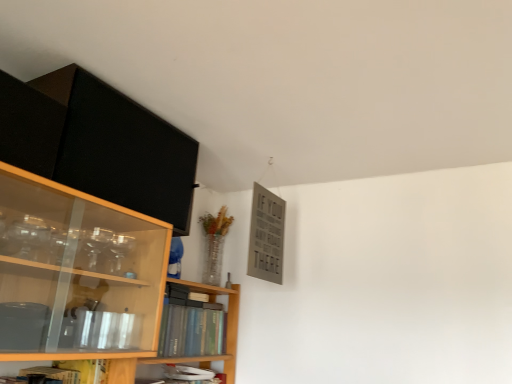
Question: Is hardcover book at center, which is the second book from bottom to top, next to matte black cabinet at upper left?

Choices:
 (A) no
 (B) yes

Answer: (A)

Question: Is hardcover book at center, the first book when ordered from top to bottom, positioned behind matte black cabinet at upper left?

Choices:
 (A) yes
 (B) no

Answer: (A)

Question: Does hardcover book at center, the first book when ordered from top to bottom, have a greater width compared to matte black cabinet at upper left?

Choices:
 (A) yes
 (B) no

Answer: (B)

Question: Can we say hardcover book at center, the first book when ordered from top to bottom, lies outside matte black cabinet at upper left?

Choices:
 (A) yes
 (B) no

Answer: (A)

Question: From the image's perspective, is hardcover book at center, the first book when ordered from top to bottom, above matte black cabinet at upper left?

Choices:
 (A) yes
 (B) no

Answer: (B)

Question: Is point (176, 375) positioned closer to the camera than point (218, 336)?

Choices:
 (A) closer
 (B) farther

Answer: (A)

Question: From their relative heights in the image, would you say hardcover book at lower center, placed as the 2th book when sorted from top to bottom, is taller or shorter than hardcover book at center, which is the second book from bottom to top?

Choices:
 (A) tall
 (B) short

Answer: (B)

Question: Which is correct: hardcover book at lower center, placed as the 2th book when sorted from top to bottom, is inside hardcover book at center, the first book when ordered from top to bottom, or outside of it?

Choices:
 (A) inside
 (B) outside

Answer: (B)

Question: Based on their positions, is hardcover book at lower center, which is counted as the 1th book, starting from the bottom, located to the left or right of hardcover book at center, which is the second book from bottom to top?

Choices:
 (A) left
 (B) right

Answer: (B)

Question: Looking at the image, does hardcover book at center, the first book when ordered from top to bottom, seem bigger or smaller compared to hardcover book at lower center, which is counted as the 1th book, starting from the bottom?

Choices:
 (A) big
 (B) small

Answer: (A)

Question: From their relative heights in the image, would you say hardcover book at center, which is the second book from bottom to top, is taller or shorter than hardcover book at lower center, placed as the 2th book when sorted from top to bottom?

Choices:
 (A) tall
 (B) short

Answer: (A)

Question: From the image's perspective, is hardcover book at center, which is the second book from bottom to top, positioned above or below hardcover book at lower center, placed as the 2th book when sorted from top to bottom?

Choices:
 (A) above
 (B) below

Answer: (A)

Question: From a real-world perspective, relative to hardcover book at lower center, which is counted as the 1th book, starting from the bottom, is hardcover book at center, which is the second book from bottom to top, vertically above or below?

Choices:
 (A) above
 (B) below

Answer: (A)

Question: Considering the positions of matte black cabinet at upper left and hardcover book at center, the first book when ordered from top to bottom, in the image, is matte black cabinet at upper left wider or thinner than hardcover book at center, the first book when ordered from top to bottom,?

Choices:
 (A) thin
 (B) wide

Answer: (B)

Question: Would you say matte black cabinet at upper left is to the left or to the right of hardcover book at center, which is the second book from bottom to top, in the picture?

Choices:
 (A) right
 (B) left

Answer: (B)